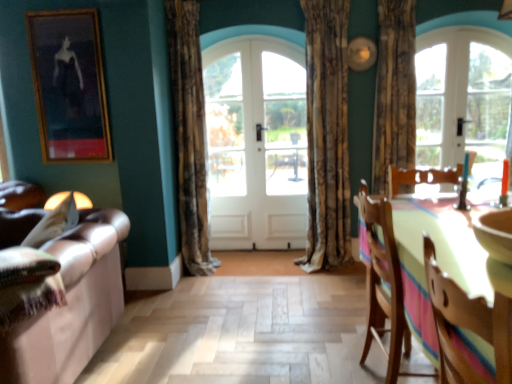
Question: Can you confirm if wooden chair at right, acting as the first chair starting from the back, is thinner than brown textured curtain at center, acting as the third curtain starting from the right?

Choices:
 (A) no
 (B) yes

Answer: (A)

Question: Is wooden chair at right, acting as the first chair starting from the back, to the left of brown textured curtain at center, the first curtain in the left-to-right sequence, from the viewer's perspective?

Choices:
 (A) no
 (B) yes

Answer: (A)

Question: Does wooden chair at right, which is the 2th chair from front to back, have a smaller size compared to brown textured curtain at center, the first curtain in the left-to-right sequence?

Choices:
 (A) yes
 (B) no

Answer: (A)

Question: Can you confirm if wooden chair at right, which is the 2th chair from front to back, is bigger than brown textured curtain at center, acting as the third curtain starting from the right?

Choices:
 (A) yes
 (B) no

Answer: (B)

Question: Considering the relative positions of wooden chair at right, acting as the first chair starting from the back, and brown textured curtain at center, the first curtain in the left-to-right sequence, in the image provided, is wooden chair at right, acting as the first chair starting from the back, behind brown textured curtain at center, the first curtain in the left-to-right sequence,?

Choices:
 (A) yes
 (B) no

Answer: (B)

Question: Is wooden chair at right, which is the 2th chair from front to back, oriented away from brown textured curtain at center, acting as the third curtain starting from the right?

Choices:
 (A) no
 (B) yes

Answer: (A)

Question: Can you confirm if wooden framed painting at upper left is wider than wooden chair at right, which is the 2th chair from front to back?

Choices:
 (A) no
 (B) yes

Answer: (A)

Question: Does wooden framed painting at upper left appear on the left side of wooden chair at right, which is the 2th chair from front to back?

Choices:
 (A) no
 (B) yes

Answer: (B)

Question: From the image's perspective, would you say wooden framed painting at upper left is shown under wooden chair at right, acting as the first chair starting from the back?

Choices:
 (A) yes
 (B) no

Answer: (B)

Question: From a real-world perspective, does wooden framed painting at upper left stand above wooden chair at right, which is the 2th chair from front to back?

Choices:
 (A) no
 (B) yes

Answer: (B)

Question: Is wooden framed painting at upper left outside of wooden chair at right, acting as the first chair starting from the back?

Choices:
 (A) no
 (B) yes

Answer: (B)

Question: Does wooden framed painting at upper left turn towards wooden chair at right, which is the 2th chair from front to back?

Choices:
 (A) no
 (B) yes

Answer: (A)

Question: Can you confirm if wooden chair at right, which is the 2th chair from front to back, is wider than white glass door at center, acting as the first screen door starting from the right?

Choices:
 (A) no
 (B) yes

Answer: (B)